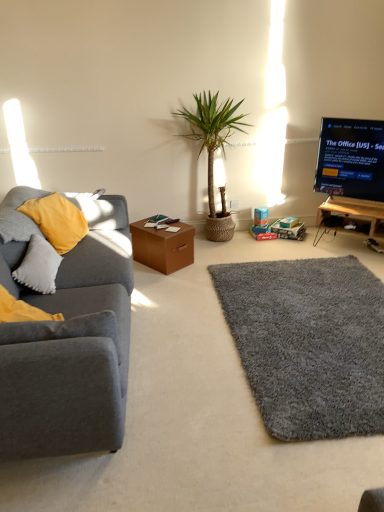
Question: Considering the positions of point (336, 274) and point (99, 368), is point (336, 274) closer or farther from the camera than point (99, 368)?

Choices:
 (A) farther
 (B) closer

Answer: (A)

Question: From a real-world perspective, relative to matte gray couch at left, is gray shaggy rug at lower right vertically above or below?

Choices:
 (A) above
 (B) below

Answer: (B)

Question: Which of these objects is positioned farthest from the brown cardboard box at center?

Choices:
 (A) soft gray cushion at left
 (B) wooden tv stand at right
 (C) black glossy tv at upper right
 (D) gray shaggy rug at lower right
 (E) green woven basket at center

Answer: (C)

Question: Estimate the real-world distances between objects in this image. Which object is farther from the soft gray cushion at left?

Choices:
 (A) brown cardboard box at center
 (B) matte gray couch at left
 (C) green woven basket at center
 (D) wooden tv stand at right
 (E) black glossy tv at upper right

Answer: (D)